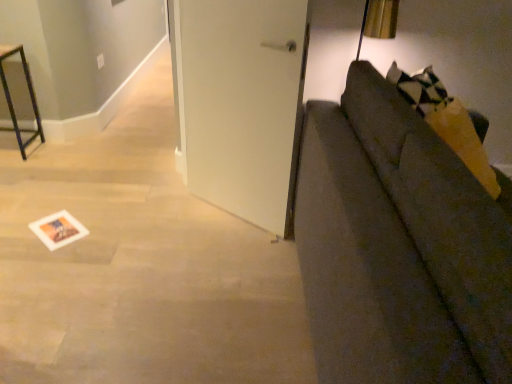
The width and height of the screenshot is (512, 384). Find the location of `free spot in front of white paper postcard at lower left`. free spot in front of white paper postcard at lower left is located at coordinates (40, 256).